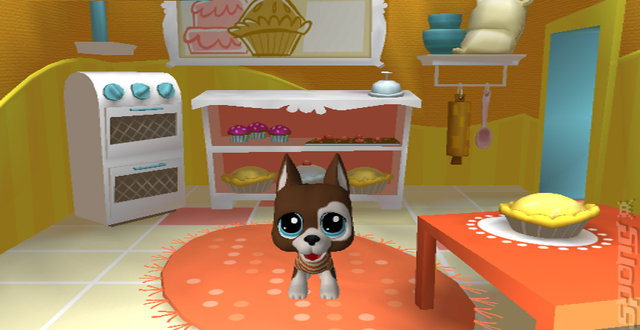
Identify the location of first knob on oven from the left. This screenshot has width=640, height=330. (118, 93).